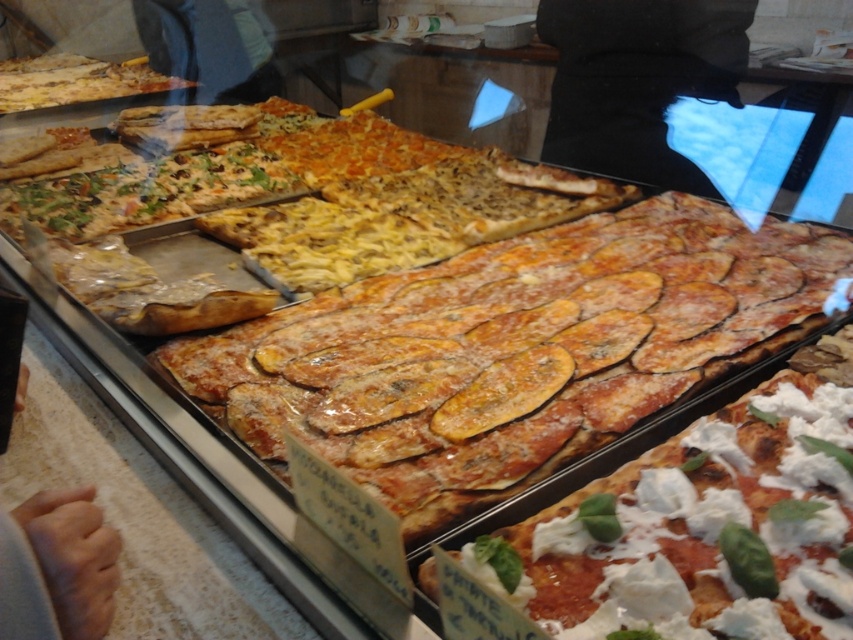
Question: Is white creamy cheese at center thinner than golden brown crust at upper left?

Choices:
 (A) yes
 (B) no

Answer: (A)

Question: Can you confirm if white creamy cheese at center is bigger than golden brown crust at upper left?

Choices:
 (A) no
 (B) yes

Answer: (A)

Question: Does white creamy cheese at center have a larger size compared to golden brown crust at upper left?

Choices:
 (A) no
 (B) yes

Answer: (A)

Question: Which object is closer to the camera taking this photo?

Choices:
 (A) golden brown crust at upper left
 (B) white creamy cheese at center

Answer: (B)

Question: Among these objects, which one is farthest from the camera?

Choices:
 (A) golden brown crust at upper left
 (B) white creamy cheese at center

Answer: (A)